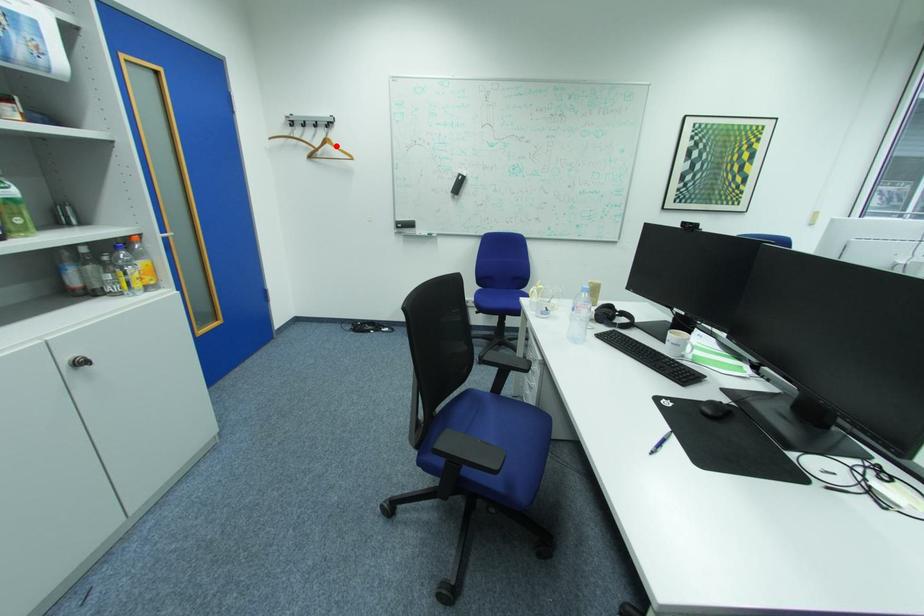
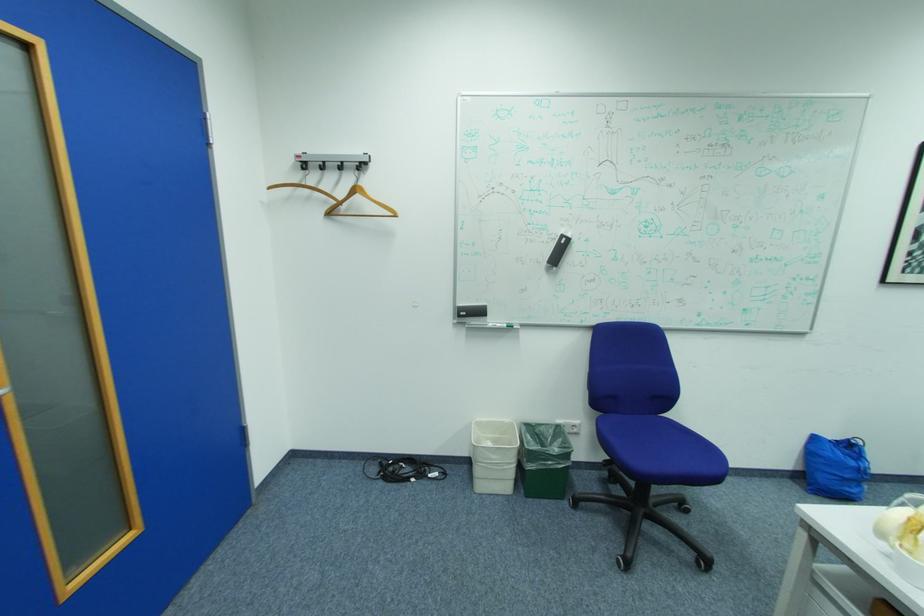
Find the pixel in the second image that matches the highlighted location in the first image.

(366, 197)